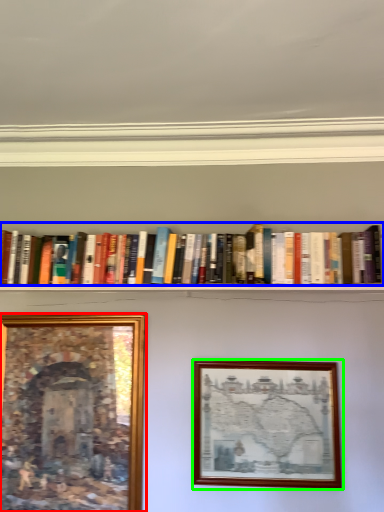
Question: Estimate the real-world distances between objects in this image. Which object is farther from picture frame (highlighted by a red box), book (highlighted by a blue box) or picture frame (highlighted by a green box)?

Choices:
 (A) book
 (B) picture frame

Answer: (A)